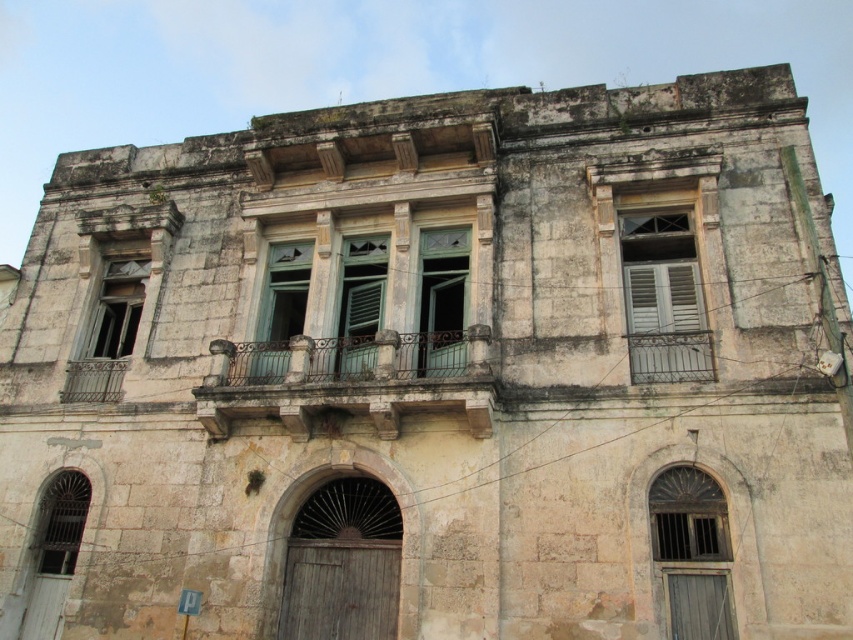
Between green glass window at center and matte glass window at lower left, which one appears on the right side from the viewer's perspective?

Positioned to the right is green glass window at center.

Who is higher up, green glass window at center or matte glass window at lower left?

green glass window at center is higher up.

Where is `green glass window at center`? green glass window at center is located at coordinates (442, 300).

You are a GUI agent. You are given a task and a screenshot of the screen. Output one action in this format:
    pyautogui.click(x=<x>, y=<y>)
    Task: Click on the green glass window at center
    The height and width of the screenshot is (640, 853).
    Given the screenshot: What is the action you would take?
    pyautogui.click(x=442, y=300)

Between rusty metal balcony at center and matte glass window at lower left, which one appears on the right side from the viewer's perspective?

From the viewer's perspective, rusty metal balcony at center appears more on the right side.

Is point (323, 340) farther from camera compared to point (65, 474)?

No, it is in front of (65, 474).

Is point (402, 378) closer to viewer compared to point (45, 509)?

Yes, point (402, 378) is closer to viewer.

Where is `rusty metal balcony at center`? The image size is (853, 640). rusty metal balcony at center is located at coordinates (350, 381).

Is white wooden window at upper right wider than teal glass window at center?

Indeed, white wooden window at upper right has a greater width compared to teal glass window at center.

Find the location of a particular element. Image resolution: width=853 pixels, height=640 pixels. white wooden window at upper right is located at coordinates (663, 298).

What are the coordinates of `white wooden window at upper right` in the screenshot? It's located at (663, 298).